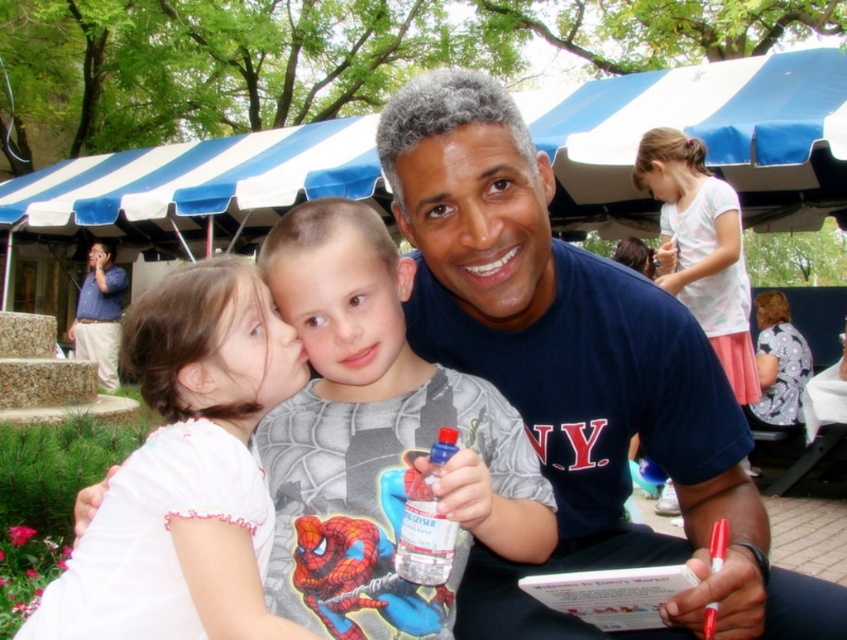
You are a photographer trying to capture a group photo of the white cotton shirt at upper left and the blue shirt at left. Which shirt should you focus on first if you want to ensure both are in the frame?

The white cotton shirt at upper left is positioned under the blue shirt at left, so you should focus on the blue shirt at left first to ensure both are in the frame.

You are standing in the park and see two points in the scene. Which point is closer to you, point (200, 304) or point (108, 340)?

Point (200, 304) is closer to the viewer than point (108, 340).

Based on the scene description, which object is smaller between the white cotton shirt at upper left and the blue shirt at left?

Answer: The white cotton shirt at upper left is smaller than the blue shirt at left.